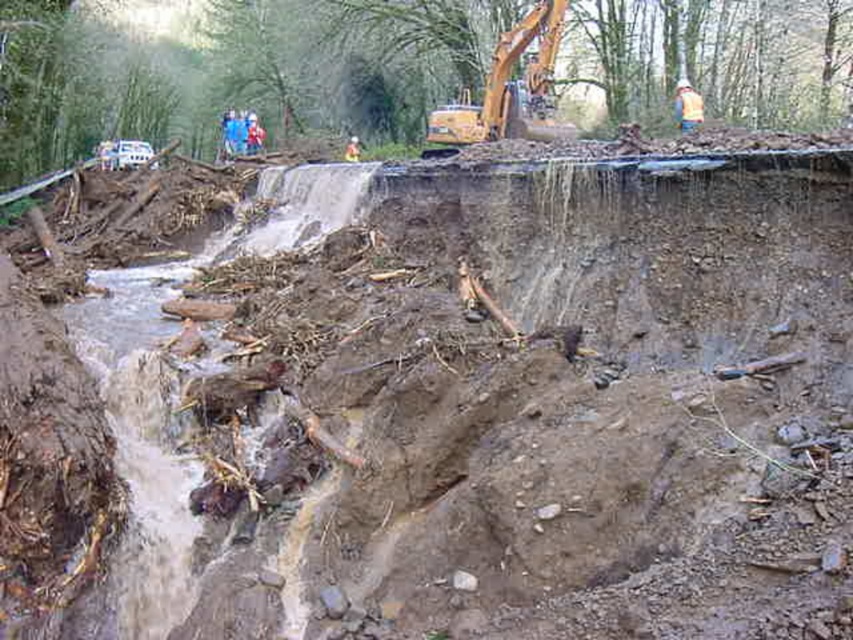
Question: Which of the following is the farthest from the observer?

Choices:
 (A) yellow reflective vest at upper center
 (B) yellow metallic excavator at upper center

Answer: (A)

Question: Is yellow metallic excavator at upper center bigger than yellow reflective vest at upper center?

Choices:
 (A) no
 (B) yes

Answer: (B)

Question: Does yellow metallic excavator at upper center have a smaller size compared to yellow reflective vest at upper center?

Choices:
 (A) no
 (B) yes

Answer: (A)

Question: Is yellow metallic excavator at upper center thinner than yellow reflective vest at upper center?

Choices:
 (A) yes
 (B) no

Answer: (B)